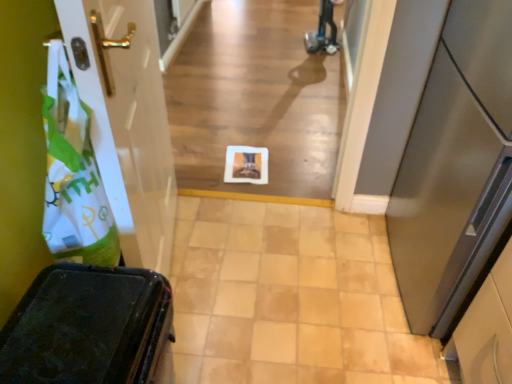
What do you see at coordinates (290, 299) in the screenshot? The width and height of the screenshot is (512, 384). I see `beige tile floor at center` at bounding box center [290, 299].

The height and width of the screenshot is (384, 512). What are the coordinates of `white matte plastic bag at left` in the screenshot? It's located at (73, 175).

The height and width of the screenshot is (384, 512). Describe the element at coordinates (73, 175) in the screenshot. I see `white matte plastic bag at left` at that location.

Describe the element at coordinates (126, 119) in the screenshot. I see `white glossy door at left, placed as the 1th door when sorted from left to right` at that location.

Identify the location of satin silver door at right, arranged as the first door when viewed from the right. (455, 167).

What do you see at coordinates (455, 167) in the screenshot? I see `satin silver door at right, arranged as the first door when viewed from the right` at bounding box center [455, 167].

This screenshot has height=384, width=512. I want to click on white paper at center, so click(x=256, y=99).

Considering the points (66, 252) and (508, 147), which point is behind, point (66, 252) or point (508, 147)?

The point (66, 252) is farther from the camera.

Can you confirm if white matte plastic bag at left is shorter than satin silver door at right, arranged as the first door when viewed from the right?

Yes.

Does white matte plastic bag at left have a greater width compared to satin silver door at right, which is counted as the second door, starting from the left?

In fact, white matte plastic bag at left might be narrower than satin silver door at right, which is counted as the second door, starting from the left.

Consider the image. Can you tell me how much satin silver door at right, which is counted as the second door, starting from the left, and white paper at center differ in facing direction?

The facing directions of satin silver door at right, which is counted as the second door, starting from the left, and white paper at center are 89.7 degrees apart.

Is satin silver door at right, which is counted as the second door, starting from the left, completely or partially outside of white paper at center?

Yes, satin silver door at right, which is counted as the second door, starting from the left, is not within white paper at center.

Considering the positions of objects satin silver door at right, which is counted as the second door, starting from the left, and white paper at center in the image provided, who is more to the right, satin silver door at right, which is counted as the second door, starting from the left, or white paper at center?

Positioned to the right is satin silver door at right, which is counted as the second door, starting from the left.

Which object is positioned more to the right, white paper at center or matte black suitcase at lower left?

Positioned to the right is white paper at center.

Can you tell me how much white paper at center and matte black suitcase at lower left differ in facing direction?

There is a 89.9-degree angle between the facing directions of white paper at center and matte black suitcase at lower left.

Is white paper at center not near matte black suitcase at lower left?

That's right, there is a large distance between white paper at center and matte black suitcase at lower left.

Which is in front, point (308, 196) or point (152, 307)?

Point (152, 307)

Which is less distant, (102, 323) or (429, 223)?

Point (102, 323) is closer to the camera than point (429, 223).

Would you say matte black suitcase at lower left is outside satin silver door at right, which is counted as the second door, starting from the left?

Yes, matte black suitcase at lower left is located beyond the bounds of satin silver door at right, which is counted as the second door, starting from the left.

Which of these two, matte black suitcase at lower left or satin silver door at right, which is counted as the second door, starting from the left, is wider?

satin silver door at right, which is counted as the second door, starting from the left.

Based on the photo, could you measure the distance between matte black suitcase at lower left and satin silver door at right, arranged as the first door when viewed from the right?

matte black suitcase at lower left and satin silver door at right, arranged as the first door when viewed from the right, are 35.68 inches apart from each other.

Is satin silver door at right, arranged as the first door when viewed from the right, closer to the viewer compared to white glossy door at left, placed as the 1th door when sorted from left to right?

No, the depth of satin silver door at right, arranged as the first door when viewed from the right, is greater than that of white glossy door at left, placed as the 1th door when sorted from left to right.

Considering the sizes of objects satin silver door at right, arranged as the first door when viewed from the right, and white glossy door at left, placed as the 2th door when sorted from right to left, in the image provided, who is smaller, satin silver door at right, arranged as the first door when viewed from the right, or white glossy door at left, placed as the 2th door when sorted from right to left,?

white glossy door at left, placed as the 2th door when sorted from right to left.

Would you say satin silver door at right, which is counted as the second door, starting from the left, is a long distance from white glossy door at left, placed as the 1th door when sorted from left to right?

No, satin silver door at right, which is counted as the second door, starting from the left, is not far from white glossy door at left, placed as the 1th door when sorted from left to right.

Does satin silver door at right, which is counted as the second door, starting from the left, have a greater height compared to white glossy door at left, placed as the 1th door when sorted from left to right?

No, satin silver door at right, which is counted as the second door, starting from the left, is not taller than white glossy door at left, placed as the 1th door when sorted from left to right.

Is white glossy door at left, placed as the 1th door when sorted from left to right, situated inside matte black suitcase at lower left or outside?

The correct answer is: outside.

Based on the photo, considering the sizes of objects white glossy door at left, placed as the 1th door when sorted from left to right, and matte black suitcase at lower left in the image provided, who is bigger, white glossy door at left, placed as the 1th door when sorted from left to right, or matte black suitcase at lower left?

With larger size is white glossy door at left, placed as the 1th door when sorted from left to right.

From the image's perspective, is white glossy door at left, placed as the 2th door when sorted from right to left, positioned above or below matte black suitcase at lower left?

Clearly, from the image's perspective, white glossy door at left, placed as the 2th door when sorted from right to left, is above matte black suitcase at lower left.

Would you say white glossy door at left, placed as the 2th door when sorted from right to left, is inside or outside beige tile floor at center?

white glossy door at left, placed as the 2th door when sorted from right to left, cannot be found inside beige tile floor at center.

Between point (130, 37) and point (202, 225), which one is positioned in front?

Positioned in front is point (130, 37).

Looking at this image, between white glossy door at left, placed as the 2th door when sorted from right to left, and beige tile floor at center, which one is positioned in front?

white glossy door at left, placed as the 2th door when sorted from right to left, is closer to the camera.

Identify the location of shopping bag on the left of satin silver door at right, which is counted as the second door, starting from the left. (73, 175).

Locate an element on the screen. This screenshot has height=384, width=512. the 1st door above the white paper at center (from a real-world perspective) is located at coordinates (455, 167).

When comparing their distances from white matte plastic bag at left, does satin silver door at right, arranged as the first door when viewed from the right, or white glossy door at left, placed as the 2th door when sorted from right to left, seem further?

satin silver door at right, arranged as the first door when viewed from the right, is positioned further to the anchor white matte plastic bag at left.

Based on the photo, when comparing their distances from white paper at center, does white matte plastic bag at left or beige tile floor at center seem closer?

beige tile floor at center is closer to white paper at center.

Based on their spatial positions, is white glossy door at left, placed as the 2th door when sorted from right to left, or white paper at center closer to beige tile floor at center?

Among the two, white glossy door at left, placed as the 2th door when sorted from right to left, is located nearer to beige tile floor at center.

Estimate the real-world distances between objects in this image. Which object is closer to white matte plastic bag at left, white glossy door at left, placed as the 1th door when sorted from left to right, or matte black suitcase at lower left?

Among the two, matte black suitcase at lower left is located nearer to white matte plastic bag at left.

Based on their spatial positions, is satin silver door at right, which is counted as the second door, starting from the left, or white matte plastic bag at left closer to white glossy door at left, placed as the 2th door when sorted from right to left?

white matte plastic bag at left.

When comparing their distances from matte black suitcase at lower left, does beige tile floor at center or satin silver door at right, arranged as the first door when viewed from the right, seem further?

satin silver door at right, arranged as the first door when viewed from the right.

When comparing their distances from satin silver door at right, which is counted as the second door, starting from the left, does white paper at center or white matte plastic bag at left seem further?

white paper at center is positioned further to the anchor satin silver door at right, which is counted as the second door, starting from the left.

When comparing their distances from white paper at center, does satin silver door at right, arranged as the first door when viewed from the right, or beige tile floor at center seem further?

Among the two, satin silver door at right, arranged as the first door when viewed from the right, is located further to white paper at center.

Where is `shopping bag that lies between white paper at center and beige tile floor at center from top to bottom`? The image size is (512, 384). shopping bag that lies between white paper at center and beige tile floor at center from top to bottom is located at coordinates (73, 175).

The height and width of the screenshot is (384, 512). What are the coordinates of `path between white matte plastic bag at left and satin silver door at right, arranged as the first door when viewed from the right, from left to right` in the screenshot? It's located at (290, 299).

What are the coordinates of `furniture located between white matte plastic bag at left and satin silver door at right, which is counted as the second door, starting from the left, in the left-right direction` in the screenshot? It's located at (87, 327).

The height and width of the screenshot is (384, 512). Identify the location of shopping bag between white glossy door at left, placed as the 2th door when sorted from right to left, and matte black suitcase at lower left in the up-down direction. (73, 175).